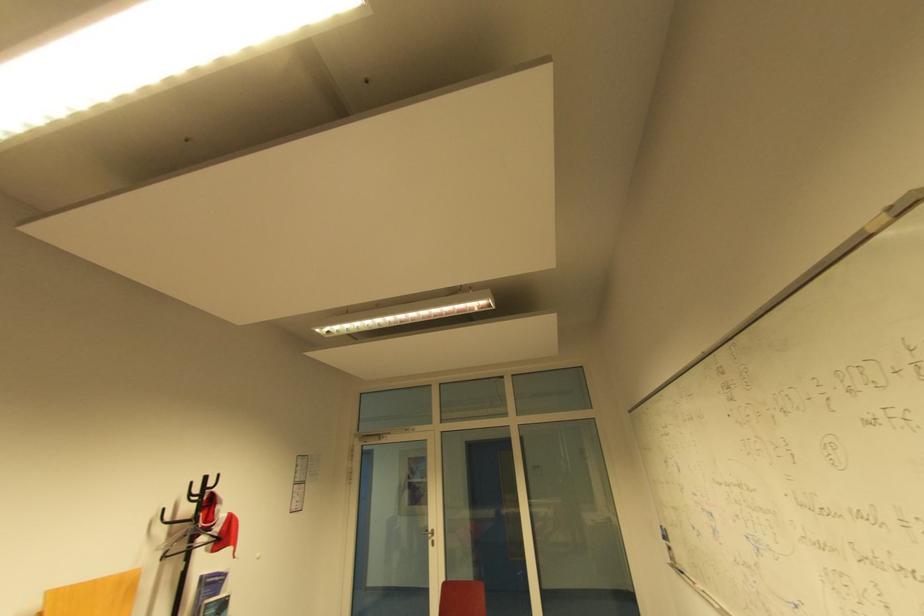
Where would you turn the silver door handle? Please return your answer as a coordinate pair (x, y).

(428, 535)